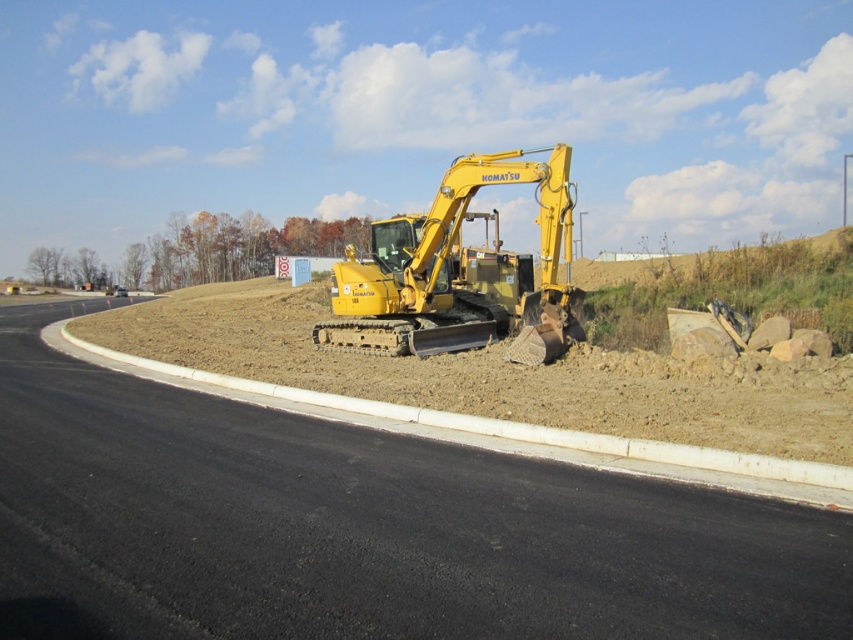
You are a surveyor checking the alignment of the black asphalt highway at center and the yellow metallic excavator at center. Based on their positions, which object is situated lower in the image?

The black asphalt highway at center is situated lower than the yellow metallic excavator at center according to the description.

You are standing at the camera position and want to walk to point (12, 312). The excavator is between you and the point. Can you walk around the excavator to reach the point?

The distance between point (12, 312) and the camera is 147.79 feet. Since the excavator is between you and the point, you would need to navigate around it to reach the desired location. However, the question does not provide information about the excavator size or path availability, so it is unclear if there is a clear path to go around. The answer cannot be definitively determined with the given information.

You are operating the yellow Komatsu excavator on the freshly paved road. You need to move towards the point that is closer to the trees with autumnal foliage in the background. Which point should you move towards, point (358, 476) or point (438, 308)?

Point (358, 476) is in front of point (438, 308), so moving towards point (358, 476) would place you closer to the trees with autumnal foliage in the background.